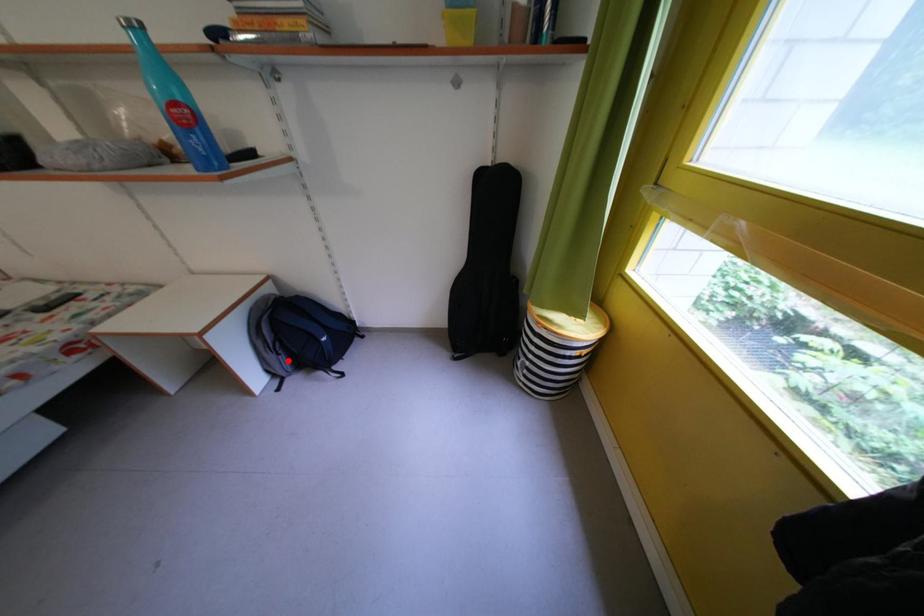
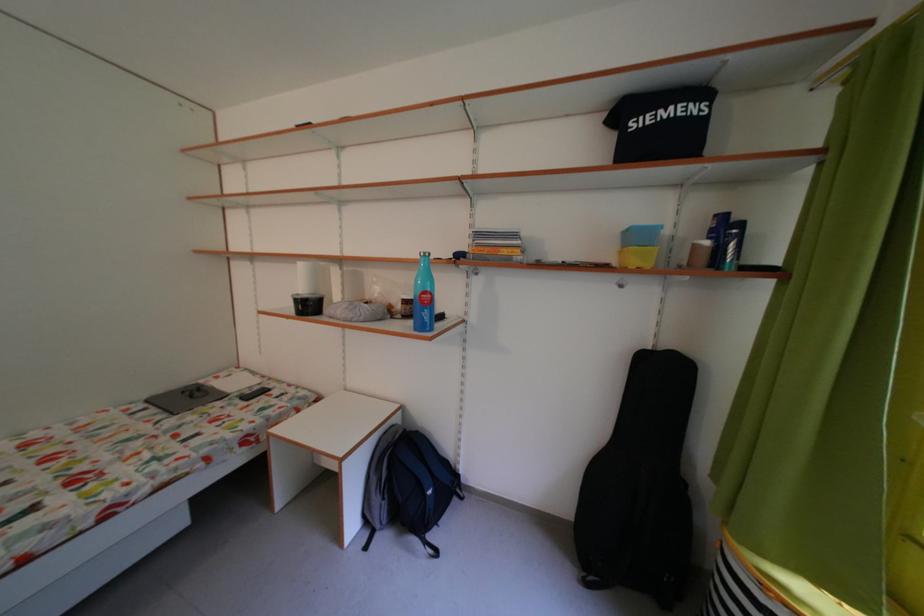
Question: I am providing you with two images of the same scene from different viewpoints. Given a red point in image1, look at the same physical point in image2. Is it:

Choices:
 (A) Closer to the viewpoint
 (B) Farther from the viewpoint

Answer: (B)